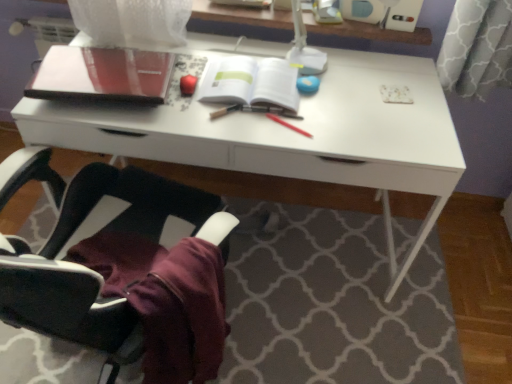
At what (x,y) coordinates should I click in order to perform the action: click on free space to the back side of glossy red apple at upper center, which ranks as the first stationery in left-to-right order. Please return your answer as a coordinate pair (x, y). Looking at the image, I should click on [196, 70].